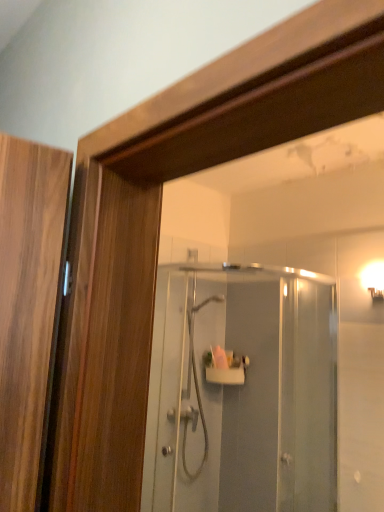
Question: From the image's perspective, is clear glass shower door at center positioned above or below white glossy shower at center?

Choices:
 (A) above
 (B) below

Answer: (A)

Question: From their relative heights in the image, would you say clear glass shower door at center is taller or shorter than white glossy shower at center?

Choices:
 (A) tall
 (B) short

Answer: (A)

Question: Which of these objects is positioned farthest from the clear glass shower door at center?

Choices:
 (A) white glossy wall sconce at upper right
 (B) white glossy shower at center

Answer: (A)

Question: Which of these objects is positioned farthest from the white glossy shower at center?

Choices:
 (A) white glossy wall sconce at upper right
 (B) clear glass shower door at center

Answer: (A)